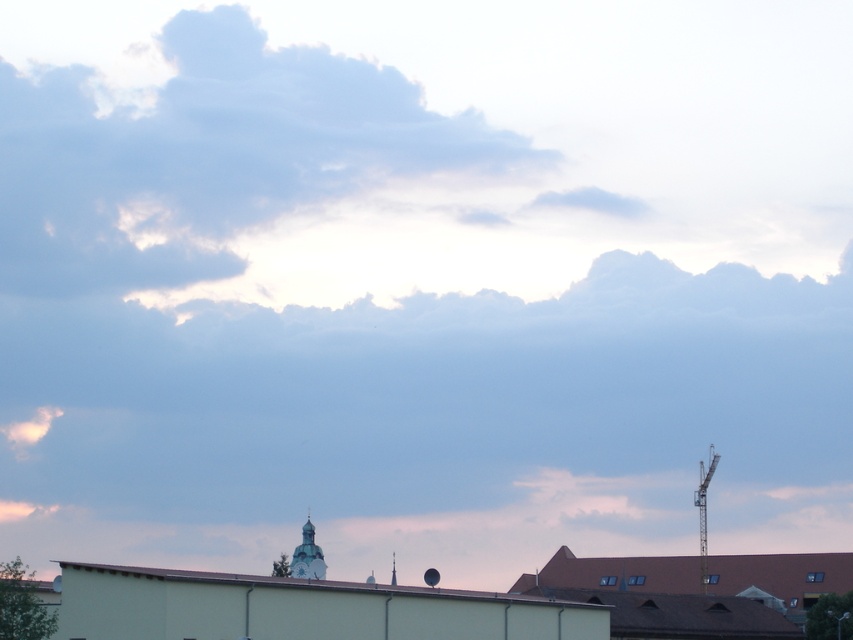
You are a city planner assessing the urban layout. The white stone tower at center and the metallic gray crane at right are both critical to the cityscape. Given that the city has a regulation requiring at least 50 meters of separation between historical landmarks and construction equipment, does the current placement comply with the regulation?

The white stone tower at center is 65.30 meters from the metallic gray crane at right, which exceeds the 50 meters requirement. Therefore, the current placement complies with the regulation.

You are an architect reviewing a city blueprint and notice the white stone tower at center and the metallic silver clock at center. According to the blueprint, which object is located to the right of the other?

The white stone tower at center is positioned on the right side of metallic silver clock at center, so the tower is to the right of the clock.

You are an architect evaluating the urban skyline. Based on the image, which structure is shorter between the white stone tower at center and the metallic gray crane at right?

The white stone tower at center is shorter than the metallic gray crane at right.